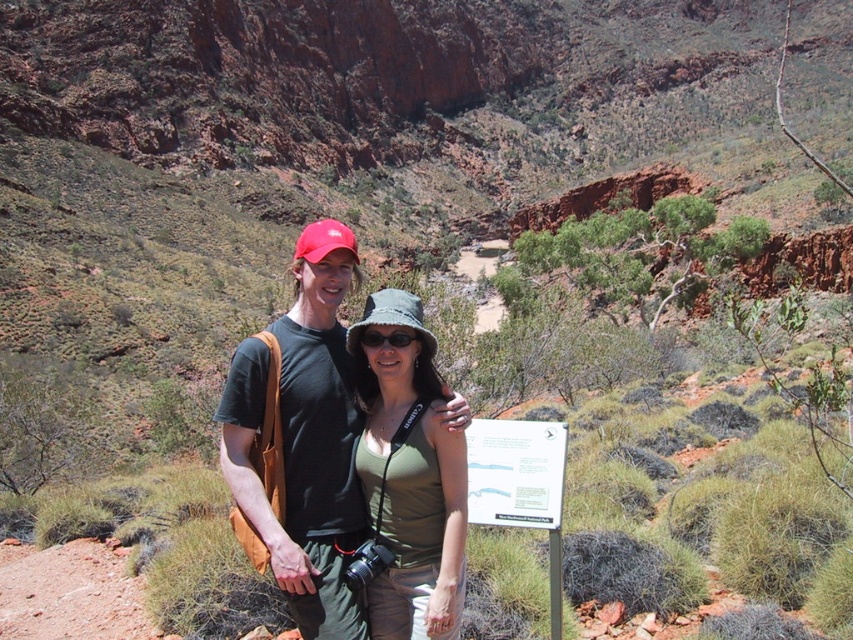
Question: Among these points, which one is farthest from the camera?

Choices:
 (A) (277, 392)
 (B) (405, 330)

Answer: (B)

Question: Estimate the real-world distances between objects in this image. Which object is farther from the black matte sunglasses at center?

Choices:
 (A) matte black shirt at center
 (B) green fabric hat at center

Answer: (A)

Question: Does matte black shirt at center have a lesser width compared to black matte sunglasses at center?

Choices:
 (A) no
 (B) yes

Answer: (A)

Question: Is green fabric hat at center positioned before black matte sunglasses at center?

Choices:
 (A) no
 (B) yes

Answer: (B)

Question: Which is nearer to the black matte sunglasses at center?

Choices:
 (A) matte black shirt at center
 (B) green fabric hat at center

Answer: (B)

Question: Can you confirm if matte black shirt at center is smaller than green fabric hat at center?

Choices:
 (A) yes
 (B) no

Answer: (B)